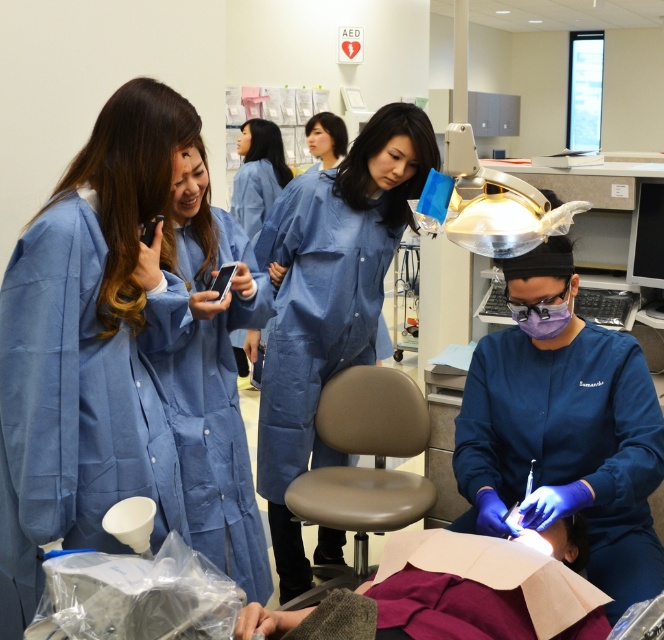
Question: Can you confirm if blue smooth surgical gown at center is positioned to the left of blue smooth uniform at center?

Choices:
 (A) no
 (B) yes

Answer: (A)

Question: Which point is farther to the camera?

Choices:
 (A) blue fabric phone at center
 (B) blue smooth uniform at center
 (C) matte black phone at center

Answer: (B)

Question: Which of the following is the farthest from the observer?

Choices:
 (A) blue smooth uniform at center
 (B) purple matte mask at center
 (C) blue smooth surgical gown at center
 (D) blue fabric phone at center

Answer: (A)

Question: Can you confirm if blue fabric coat at center is thinner than blue smooth uniform at center?

Choices:
 (A) no
 (B) yes

Answer: (A)

Question: Does blue fabric coat at center lie behind blue fabric phone at center?

Choices:
 (A) no
 (B) yes

Answer: (B)

Question: Estimate the real-world distances between objects in this image. Which object is closer to the blue smooth surgical gown at center?

Choices:
 (A) blue fabric phone at center
 (B) purple matte mask at center
 (C) matte black phone at center

Answer: (B)